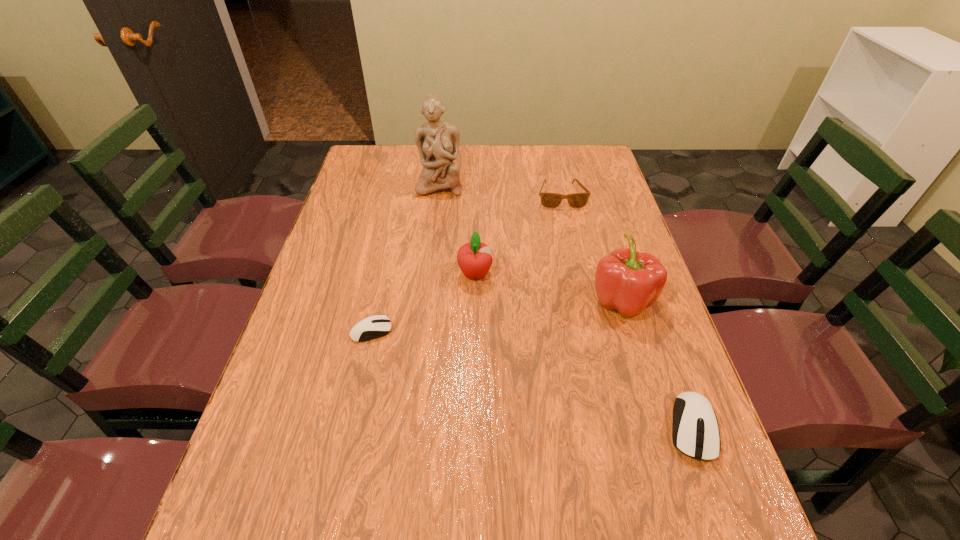
Image resolution: width=960 pixels, height=540 pixels. I want to click on free area in between the sunglasses and the tallest object, so click(x=500, y=191).

Image resolution: width=960 pixels, height=540 pixels. What are the coordinates of `free space between the pepper and the tallest object` in the screenshot? It's located at (531, 242).

I want to click on free space between the taller mouse and the third object from left to right, so click(584, 350).

Identify the location of vacant area that lies between the second tallest object and the third tallest object. (548, 287).

Where is `unoccupied area between the fourth object from right to left and the sunglasses`? This screenshot has width=960, height=540. unoccupied area between the fourth object from right to left and the sunglasses is located at coordinates (518, 235).

Select which object is the closest to the sunglasses. Please provide its 2D coordinates. Your answer should be formatted as a tuple, i.e. [(x, y)], where the tuple contains the x and y coordinates of a point satisfying the conditions above.

[(438, 142)]

I want to click on object that is the second closest one to the shorter mouse, so click(x=626, y=280).

This screenshot has width=960, height=540. I want to click on free space that satisfies the following two spatial constraints: 1. on the frames of the sunglasses; 2. on the right side of the nearer mouse, so click(613, 427).

This screenshot has height=540, width=960. Identify the location of vacant region that satisfies the following two spatial constraints: 1. on the front-facing side of the figurine; 2. on the right side of the pepper. (426, 300).

Where is `free space that satisfies the following two spatial constraints: 1. on the front-facing side of the figurine; 2. on the right side of the pepper`? free space that satisfies the following two spatial constraints: 1. on the front-facing side of the figurine; 2. on the right side of the pepper is located at coordinates [x=426, y=300].